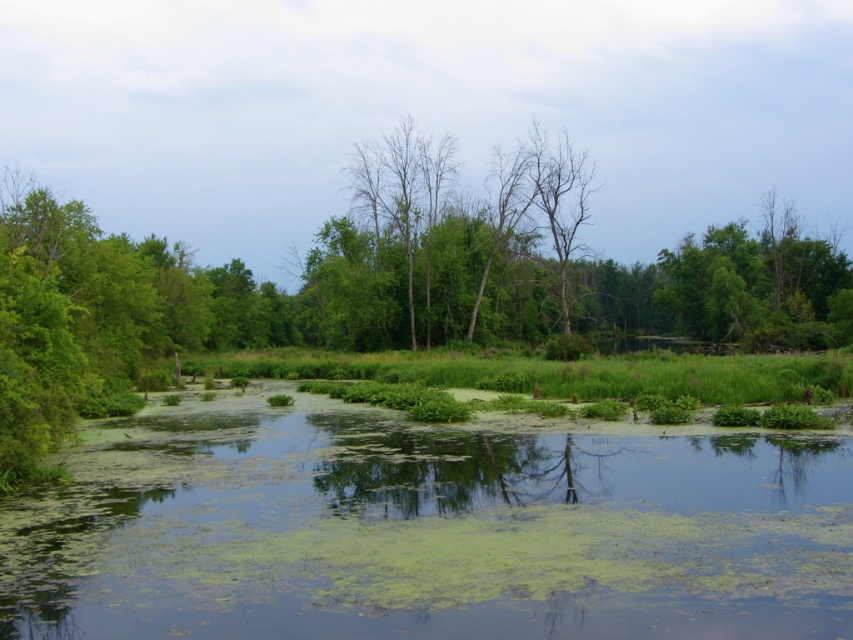
Question: Which point is farther to the camera?

Choices:
 (A) green algae-covered water at center
 (B) bare branches at center

Answer: (B)

Question: Does green algae-covered water at center appear on the right side of bare branches at center?

Choices:
 (A) yes
 (B) no

Answer: (A)

Question: Does green algae-covered water at center have a lesser width compared to bare branches at center?

Choices:
 (A) yes
 (B) no

Answer: (A)

Question: In this image, where is green algae-covered water at center located relative to bare branches at center?

Choices:
 (A) left
 (B) right

Answer: (B)

Question: Among these points, which one is farthest from the camera?

Choices:
 (A) (532, 449)
 (B) (379, 212)

Answer: (B)

Question: Among these objects, which one is nearest to the camera?

Choices:
 (A) bare branches at center
 (B) green algae-covered water at center

Answer: (B)